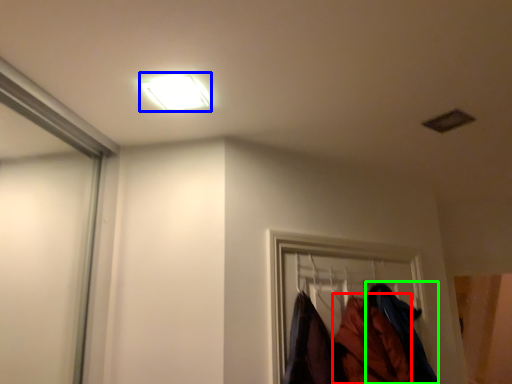
Question: Estimate the real-world distances between objects in this image. Which object is closer to clothing (highlighted by a red box), lamp (highlighted by a blue box) or clothing (highlighted by a green box)?

Choices:
 (A) lamp
 (B) clothing

Answer: (B)